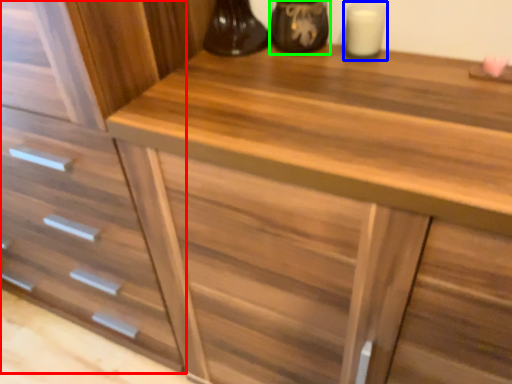
Question: Based on their relative distances, which object is farther from drawer (highlighted by a red box)? Choose from candle holder (highlighted by a blue box) and appliance (highlighted by a green box).

Choices:
 (A) candle holder
 (B) appliance

Answer: (A)